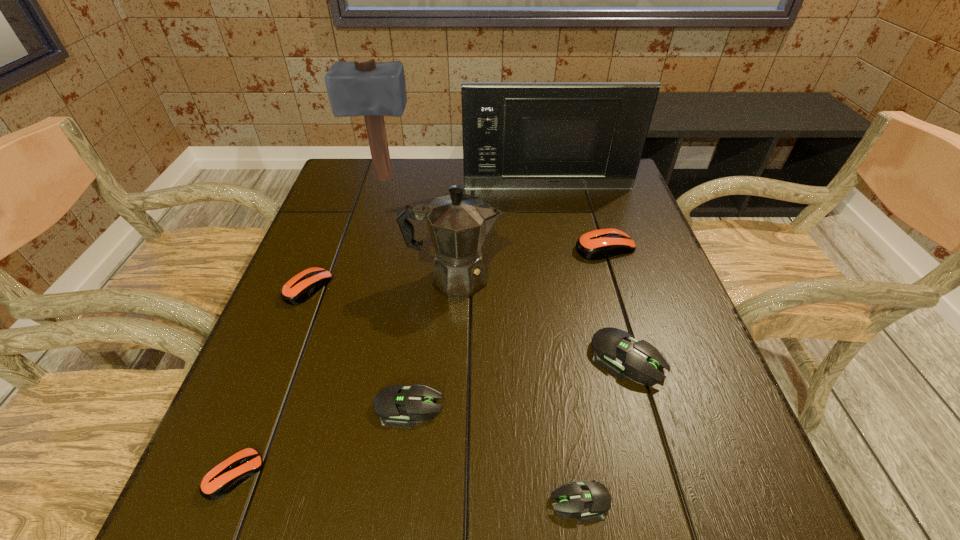
In the image, there is a desktop. What are the coordinates of `vacant space at the near edge` in the screenshot? It's located at (486, 491).

The width and height of the screenshot is (960, 540). I want to click on free spot at the left edge of the desktop, so click(x=348, y=210).

Where is `free space at the right edge of the desktop`? This screenshot has width=960, height=540. free space at the right edge of the desktop is located at coordinates (703, 362).

Where is `free space at the far left corner`? This screenshot has height=540, width=960. free space at the far left corner is located at coordinates (381, 190).

Where is `free space at the near left corner of the desktop`? free space at the near left corner of the desktop is located at coordinates (281, 483).

This screenshot has width=960, height=540. Identify the location of free space at the far right corner. (617, 201).

Find the location of a particular element. The height and width of the screenshot is (540, 960). vacant area at the near right corner of the desktop is located at coordinates (708, 482).

At what (x,y) coordinates should I click in order to perform the action: click on vacant space that is in between the smallest gray computer mouse and the second smallest gray computer mouse. Please return your answer as a coordinate pair (x, y). The image size is (960, 540). Looking at the image, I should click on click(x=494, y=454).

At what (x,y) coordinates should I click in order to perform the action: click on vacant area that lies between the biggest orange computer mouse and the seventh shortest object. Please return your answer as a coordinate pair (x, y). Looking at the image, I should click on (529, 262).

The height and width of the screenshot is (540, 960). I want to click on vacant space that is in between the mallet and the third computer mouse from right to left, so click(481, 340).